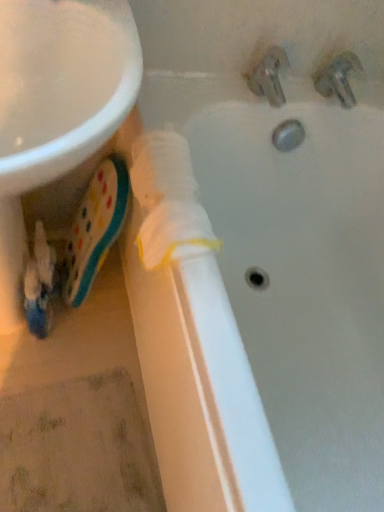
Question: Is white matte pipe at center wider than matte plastic toothpaste at lower left?

Choices:
 (A) yes
 (B) no

Answer: (A)

Question: Are white matte pipe at center and matte plastic toothpaste at lower left beside each other?

Choices:
 (A) no
 (B) yes

Answer: (A)

Question: From a real-world perspective, is white matte pipe at center beneath matte plastic toothpaste at lower left?

Choices:
 (A) no
 (B) yes

Answer: (A)

Question: From the image's perspective, is white matte pipe at center above matte plastic toothpaste at lower left?

Choices:
 (A) yes
 (B) no

Answer: (B)

Question: Can we say white matte pipe at center lies outside matte plastic toothpaste at lower left?

Choices:
 (A) no
 (B) yes

Answer: (B)

Question: Does white matte pipe at center contain matte plastic toothpaste at lower left?

Choices:
 (A) no
 (B) yes

Answer: (A)

Question: Is metallic silver tap at upper right, marked as the 1th tap in a right-to-left arrangement, taller than metallic chrome faucet at upper right, which is counted as the 1th tap, starting from the left?

Choices:
 (A) yes
 (B) no

Answer: (B)

Question: Is metallic silver tap at upper right, the 2th tap when ordered from left to right, oriented away from metallic chrome faucet at upper right, the second tap viewed from the right?

Choices:
 (A) no
 (B) yes

Answer: (A)

Question: Is metallic silver tap at upper right, the 2th tap when ordered from left to right, closer to camera compared to metallic chrome faucet at upper right, which is counted as the 1th tap, starting from the left?

Choices:
 (A) yes
 (B) no

Answer: (B)

Question: Is metallic silver tap at upper right, marked as the 1th tap in a right-to-left arrangement, at the left side of metallic chrome faucet at upper right, the second tap viewed from the right?

Choices:
 (A) no
 (B) yes

Answer: (A)

Question: Is metallic silver tap at upper right, marked as the 1th tap in a right-to-left arrangement, next to metallic chrome faucet at upper right, the second tap viewed from the right, and touching it?

Choices:
 (A) no
 (B) yes

Answer: (A)

Question: Are metallic silver tap at upper right, the 2th tap when ordered from left to right, and metallic chrome faucet at upper right, the second tap viewed from the right, far apart?

Choices:
 (A) no
 (B) yes

Answer: (A)

Question: Considering the relative positions of metallic silver tap at upper right, marked as the 1th tap in a right-to-left arrangement, and white matte pipe at center in the image provided, is metallic silver tap at upper right, marked as the 1th tap in a right-to-left arrangement, to the left of white matte pipe at center from the viewer's perspective?

Choices:
 (A) yes
 (B) no

Answer: (B)